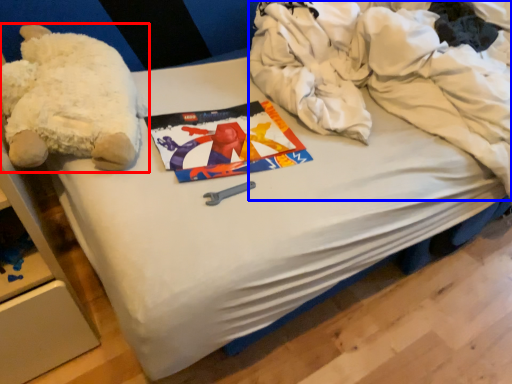
Question: Which object appears closest to the camera in this image, teddy bear (highlighted by a red box) or clothing (highlighted by a blue box)?

Choices:
 (A) teddy bear
 (B) clothing

Answer: (B)